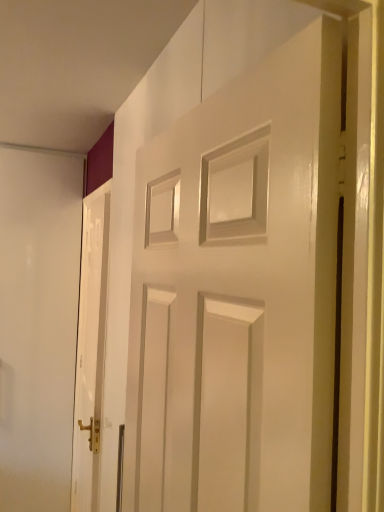
Question: Is glossy white door at center, the 1th door in the right-to-left sequence, bigger or smaller than white glossy door at left, arranged as the first door when viewed from the back?

Choices:
 (A) big
 (B) small

Answer: (A)

Question: Considering the relative positions of glossy white door at center, marked as the second door in a left-to-right arrangement, and white glossy door at left, which is counted as the first door, starting from the left, in the image provided, is glossy white door at center, marked as the second door in a left-to-right arrangement, to the left or to the right of white glossy door at left, which is counted as the first door, starting from the left,?

Choices:
 (A) right
 (B) left

Answer: (A)

Question: From the image's perspective, is glossy white door at center, the first door when ordered from front to back, above or below white glossy door at left, arranged as the first door when viewed from the back?

Choices:
 (A) above
 (B) below

Answer: (A)

Question: Is white glossy door at left, which ranks as the 2th door in front-to-back order, in front of or behind glossy white door at center, the 1th door in the right-to-left sequence, in the image?

Choices:
 (A) front
 (B) behind

Answer: (B)

Question: In terms of height, does white glossy door at left, which is counted as the first door, starting from the left, look taller or shorter compared to glossy white door at center, which is counted as the second door, starting from the back?

Choices:
 (A) tall
 (B) short

Answer: (A)

Question: From the image's perspective, relative to glossy white door at center, the 1th door in the right-to-left sequence, is white glossy door at left, which is the second door in right-to-left order, above or below?

Choices:
 (A) above
 (B) below

Answer: (B)

Question: Visually, is white glossy door at left, which ranks as the 2th door in front-to-back order, positioned to the left or to the right of glossy white door at center, the first door when ordered from front to back?

Choices:
 (A) left
 (B) right

Answer: (A)